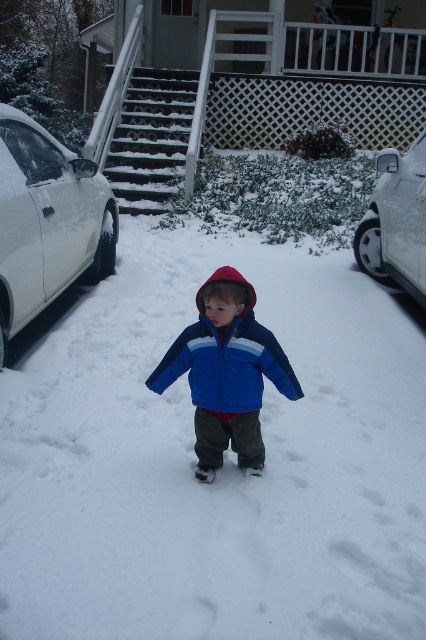
You are a photographer setting up a tripod to capture the snowy scene. You need to ensure that both the blue fleece jacket at center and the white glossy car at right are fully visible in the frame. Given their heights, which object might require you to adjust your camera angle to avoid being cut off?

The blue fleece jacket at center has a lesser height compared to the white glossy car at right, so you might need to lower the camera angle to ensure the taller white glossy car at right is fully visible without being cut off.

You are a delivery person who needs to park your vehicle in this snowy area. You have two options, the white glossy car at left and the white glossy car at right. Which car has a wider space available for parking?

The white glossy car at left has a wider space available for parking because its width is larger than the white glossy car at right.

In the scene shown: You are a photographer trying to capture a photo of the blue fleece jacket at center and the white glossy car at right. Based on their positions, which object should you focus on first to ensure both are in sharp focus?

The blue fleece jacket at center is closer to the viewer than the white glossy car at right. To ensure both are in sharp focus, you should focus on the blue fleece jacket at center first because it is closer, and then adjust the focus to include the white glossy car at right in the background.